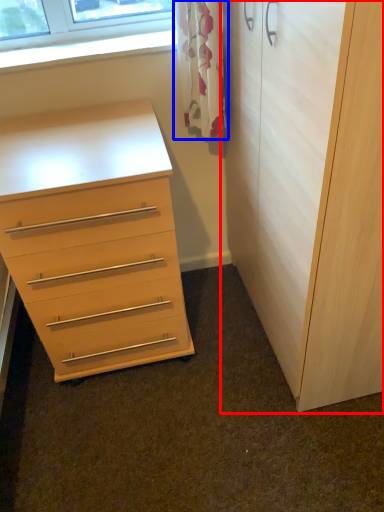
Question: Which of the following is the closest to the observer, cupboard (highlighted by a red box) or curtain (highlighted by a blue box)?

Choices:
 (A) cupboard
 (B) curtain

Answer: (A)